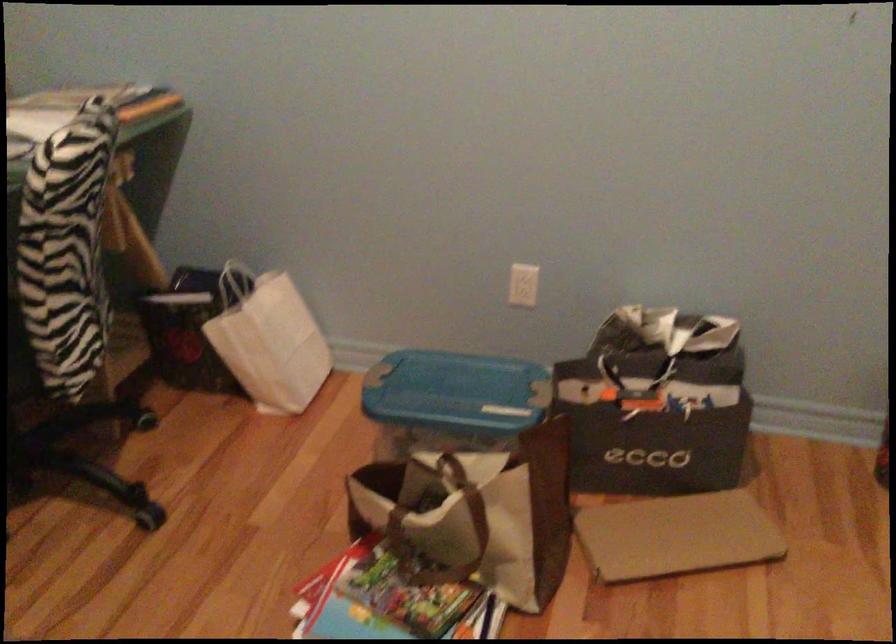
I want to click on beige bag handle, so click(x=427, y=554).